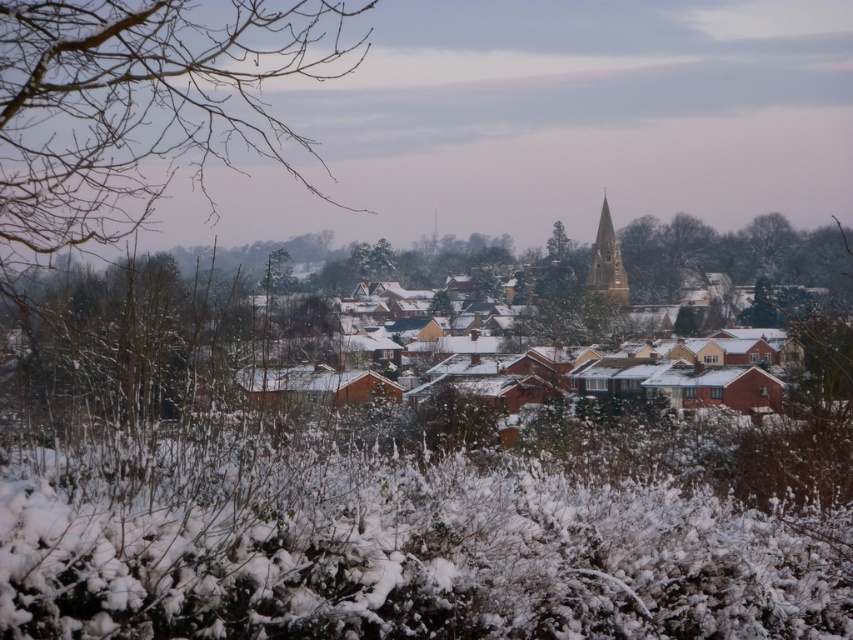
Does golden stone spire at center appear on the right side of green leafy tree at center?

Indeed, golden stone spire at center is positioned on the right side of green leafy tree at center.

Consider the image. Does golden stone spire at center have a greater width compared to green leafy tree at center?

Correct, the width of golden stone spire at center exceeds that of green leafy tree at center.

Describe the element at coordinates (607, 262) in the screenshot. I see `golden stone spire at center` at that location.

I want to click on golden stone spire at center, so click(607, 262).

In the scene shown: Can you confirm if bare branches at left is wider than green leafy tree at center?

Yes.

Which is below, bare branches at left or green leafy tree at center?

green leafy tree at center is lower down.

Who is more distant from viewer, (x=178, y=83) or (x=561, y=250)?

The point (x=561, y=250) is behind.

What are the coordinates of `bare branches at left` in the screenshot? It's located at (142, 106).

Can you confirm if bare branches at left is positioned above golden stone spire at center?

Yes, bare branches at left is above golden stone spire at center.

Is the position of bare branches at left less distant than that of golden stone spire at center?

Yes, it is.

I want to click on bare branches at left, so click(142, 106).